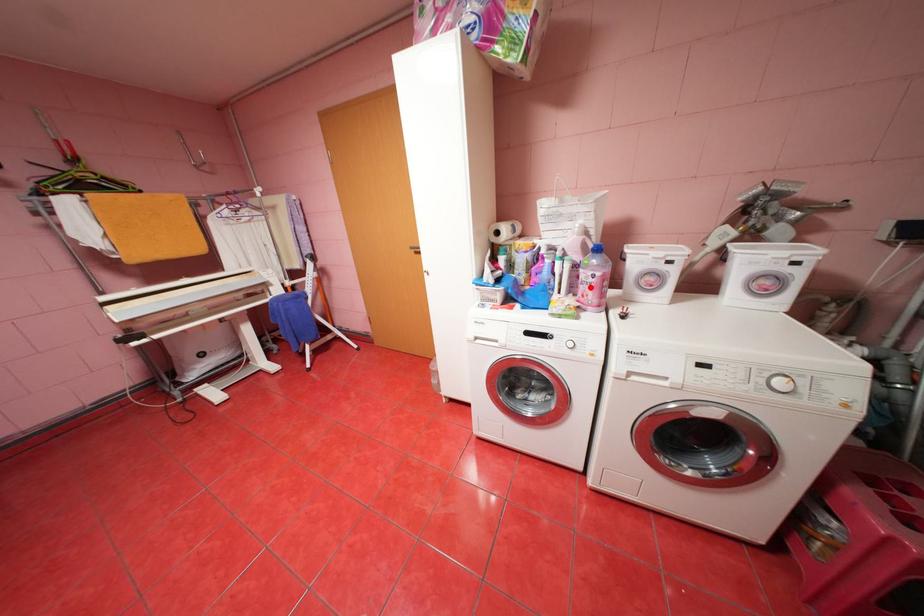
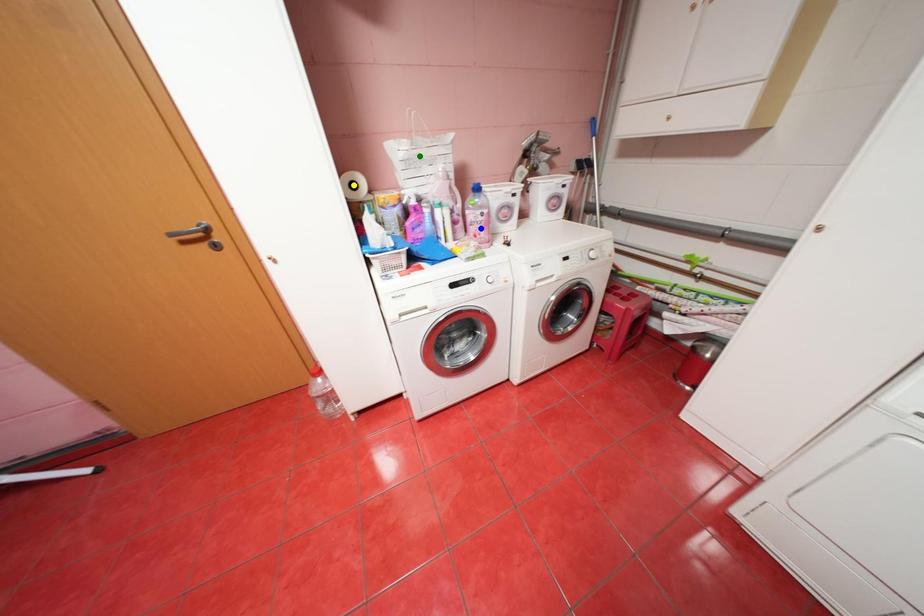
Question: I am providing you with two images of the same scene from different viewpoints. A red point is marked on the first image. You are given multiple points on the second image. Can you choose the point in image 2 that corresponds to the point in image 1?

Choices:
 (A) yellow point
 (B) blue point
 (C) green point

Answer: (B)